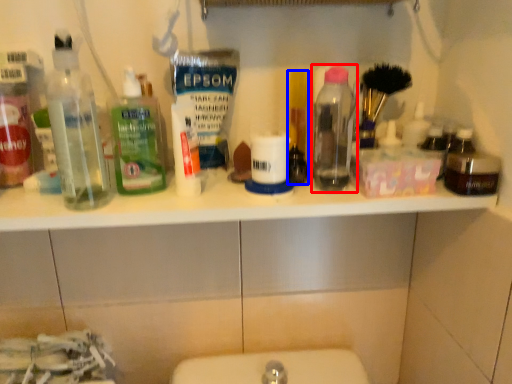
Question: Which object appears farthest to the camera in this image, bottle (highlighted by a red box) or personal care (highlighted by a blue box)?

Choices:
 (A) bottle
 (B) personal care

Answer: (B)